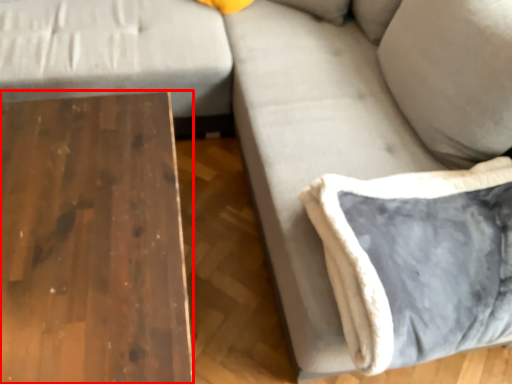
Question: From the image's perspective, what is the correct spatial positioning of table (annotated by the red box) in reference to pillow?

Choices:
 (A) below
 (B) above

Answer: (A)